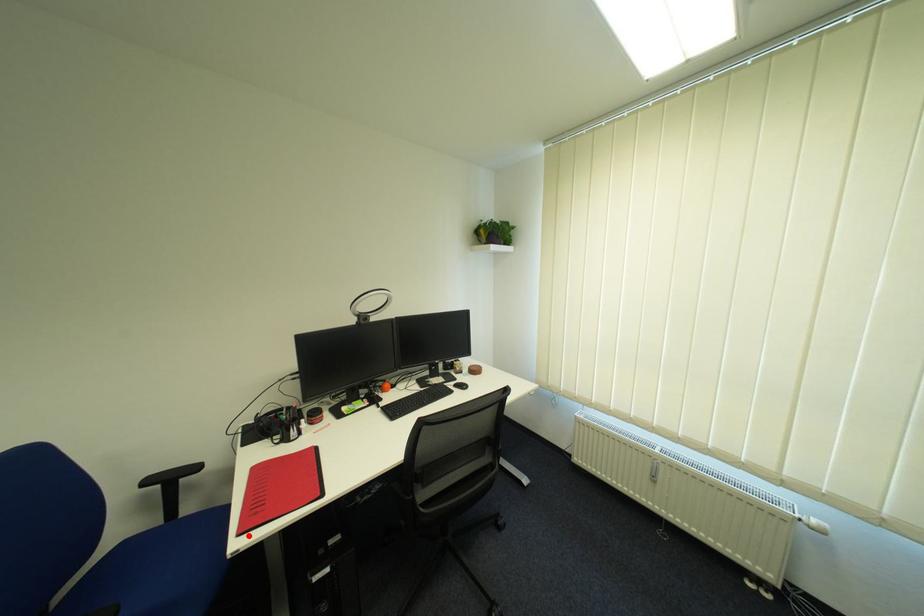
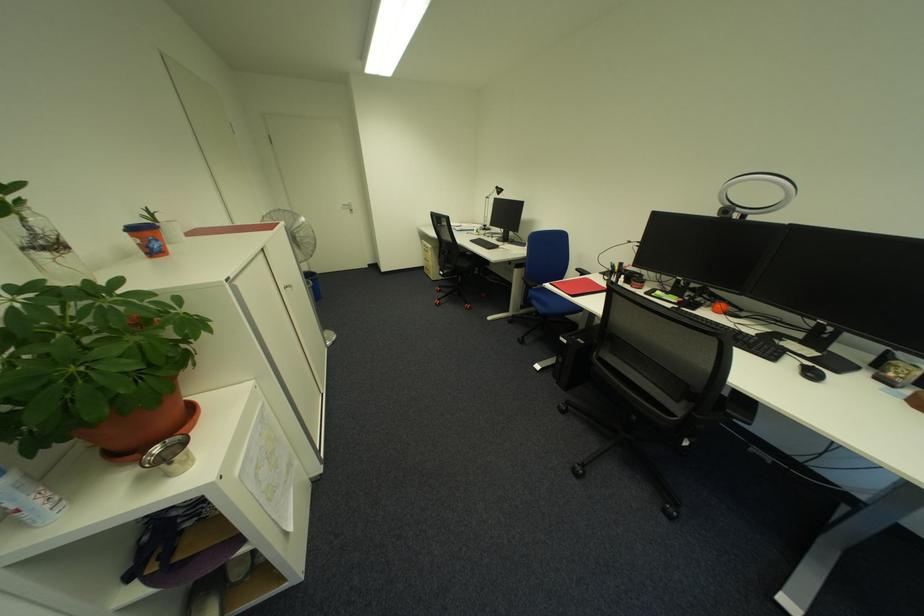
Question: I am providing you with two images of the same scene from different viewpoints. In image1, a red point is highlighted. Considering the same 3D point in image2, which of the following is correct?

Choices:
 (A) It is closer
 (B) It is farther

Answer: (A)